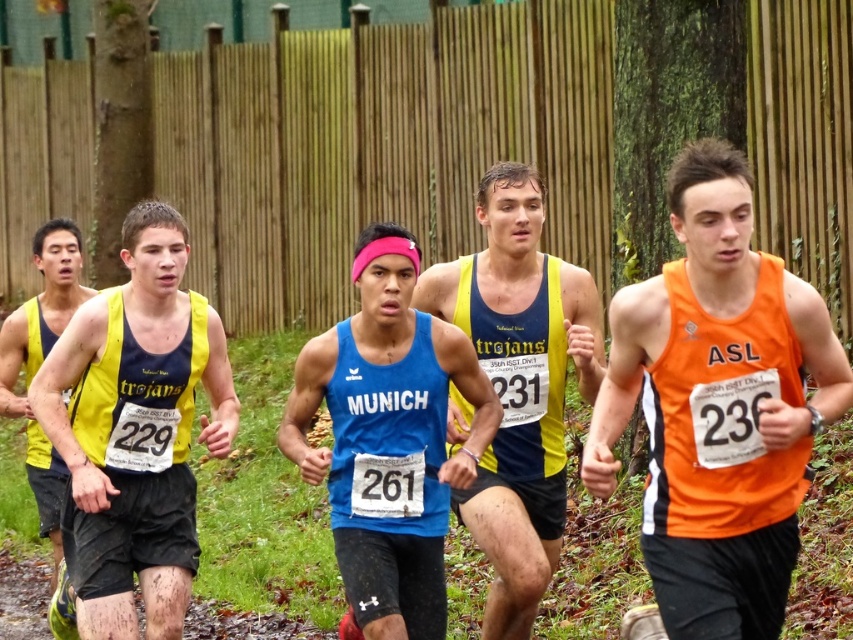
Who is positioned more to the right, yellow matte tank top at left or blue fabric tank top at center?

blue fabric tank top at center is more to the right.

Does point (91, 532) come closer to viewer compared to point (486, 348)?

Yes.

Image resolution: width=853 pixels, height=640 pixels. In order to click on yellow matte tank top at left in this screenshot , I will do `click(135, 429)`.

Based on the photo, is yellow matte tank top at left positioned before blue matte tank top at center?

No, it is not.

Who is lower down, yellow matte tank top at left or blue matte tank top at center?

blue matte tank top at center is below.

Locate an element on the screen. The height and width of the screenshot is (640, 853). yellow matte tank top at left is located at coordinates (135, 429).

At what (x,y) coordinates should I click in order to perform the action: click on yellow matte tank top at left. Please return your answer as a coordinate pair (x, y). The height and width of the screenshot is (640, 853). Looking at the image, I should click on coord(135,429).

Who is lower down, orange fabric tank top at right or blue fabric tank top at center?

Positioned lower is blue fabric tank top at center.

Can you confirm if orange fabric tank top at right is taller than blue fabric tank top at center?

Incorrect, orange fabric tank top at right's height is not larger of blue fabric tank top at center's.

Where is `orange fabric tank top at right`? This screenshot has height=640, width=853. orange fabric tank top at right is located at coordinates (718, 406).